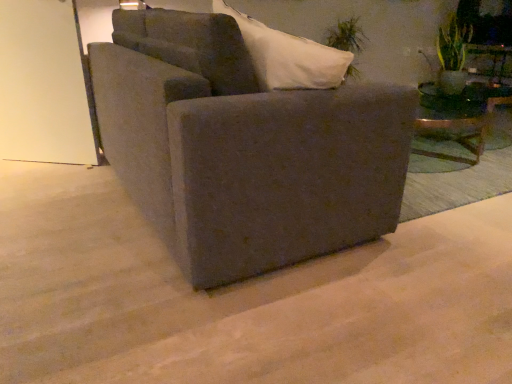
Question: Does green leafy plant at upper right, placed as the 2th plant when sorted from front to back, appear on the left side of matte gray couch at center?

Choices:
 (A) yes
 (B) no

Answer: (B)

Question: Considering the relative sizes of green leafy plant at upper right, which ranks as the second plant in right-to-left order, and matte gray couch at center in the image provided, is green leafy plant at upper right, which ranks as the second plant in right-to-left order, bigger than matte gray couch at center?

Choices:
 (A) yes
 (B) no

Answer: (B)

Question: From a real-world perspective, does green leafy plant at upper right, the 1th plant when ordered from left to right, sit lower than matte gray couch at center?

Choices:
 (A) yes
 (B) no

Answer: (B)

Question: Is matte gray couch at center surrounded by green leafy plant at upper right, placed as the 2th plant when sorted from front to back?

Choices:
 (A) yes
 (B) no

Answer: (B)

Question: Are green leafy plant at upper right, positioned as the first plant in back-to-front order, and matte gray couch at center far apart?

Choices:
 (A) no
 (B) yes

Answer: (B)

Question: From a real-world perspective, is green leafy plant at upper right, positioned as the first plant in back-to-front order, physically located above or below transparent glass door at upper left?

Choices:
 (A) above
 (B) below

Answer: (A)

Question: Would you say green leafy plant at upper right, which ranks as the second plant in right-to-left order, is to the left or to the right of transparent glass door at upper left in the picture?

Choices:
 (A) right
 (B) left

Answer: (A)

Question: From the image's perspective, relative to transparent glass door at upper left, is green leafy plant at upper right, placed as the 2th plant when sorted from front to back, above or below?

Choices:
 (A) above
 (B) below

Answer: (A)

Question: In terms of width, does green leafy plant at upper right, which ranks as the second plant in right-to-left order, look wider or thinner when compared to transparent glass door at upper left?

Choices:
 (A) wide
 (B) thin

Answer: (A)

Question: From a real-world perspective, is green leafy plant at upper right, acting as the 1th plant starting from the right, positioned above or below green leafy plant at upper right, positioned as the first plant in back-to-front order?

Choices:
 (A) above
 (B) below

Answer: (A)

Question: Considering their positions, is green leafy plant at upper right, placed as the 2th plant when sorted from back to front, located in front of or behind green leafy plant at upper right, placed as the 2th plant when sorted from front to back?

Choices:
 (A) behind
 (B) front

Answer: (B)

Question: From the image's perspective, is green leafy plant at upper right, acting as the 1th plant starting from the right, located above or below green leafy plant at upper right, which ranks as the second plant in right-to-left order?

Choices:
 (A) above
 (B) below

Answer: (B)

Question: Is green leafy plant at upper right, placed as the 2th plant when sorted from back to front, bigger or smaller than green leafy plant at upper right, placed as the 2th plant when sorted from front to back?

Choices:
 (A) small
 (B) big

Answer: (A)

Question: In terms of size, does matte gray couch at center appear bigger or smaller than transparent glass door at upper left?

Choices:
 (A) small
 (B) big

Answer: (B)

Question: Is point (156, 223) closer or farther from the camera than point (59, 13)?

Choices:
 (A) farther
 (B) closer

Answer: (B)